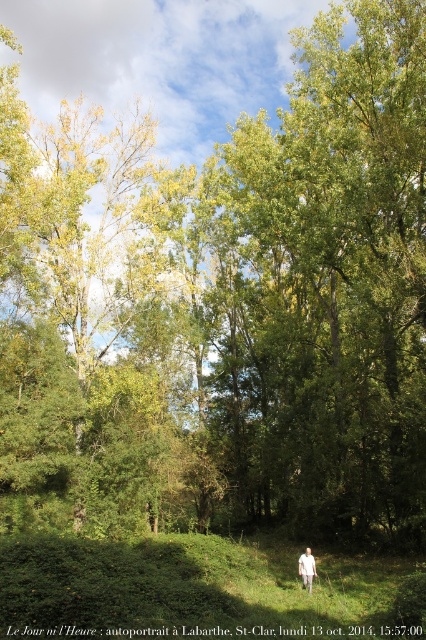
In the scene shown: Can you confirm if green grassy at center is positioned above white cotton shirt at lower center?

Indeed, green grassy at center is positioned over white cotton shirt at lower center.

The height and width of the screenshot is (640, 426). What do you see at coordinates (183, 584) in the screenshot?
I see `green grassy at center` at bounding box center [183, 584].

Locate an element on the screen. The image size is (426, 640). green grassy at center is located at coordinates (183, 584).